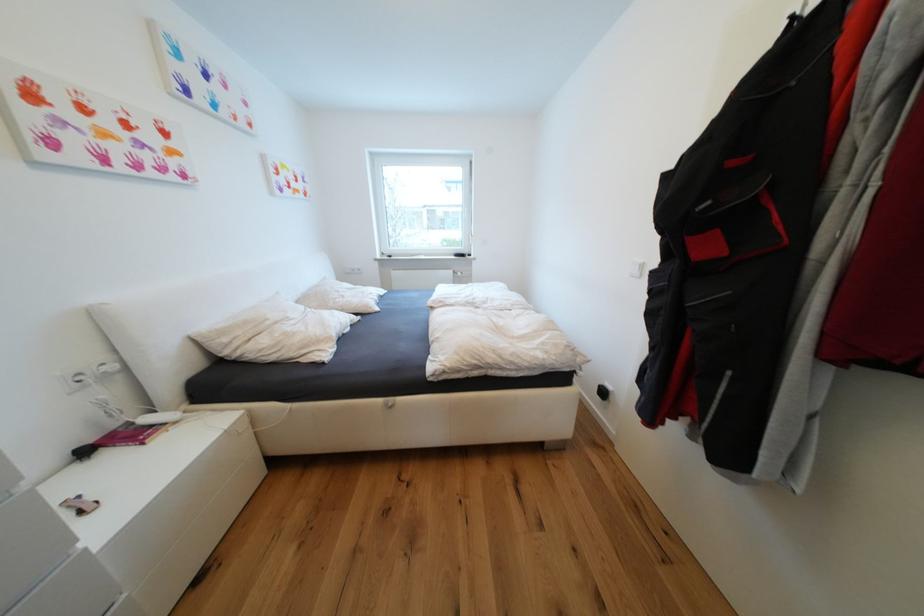
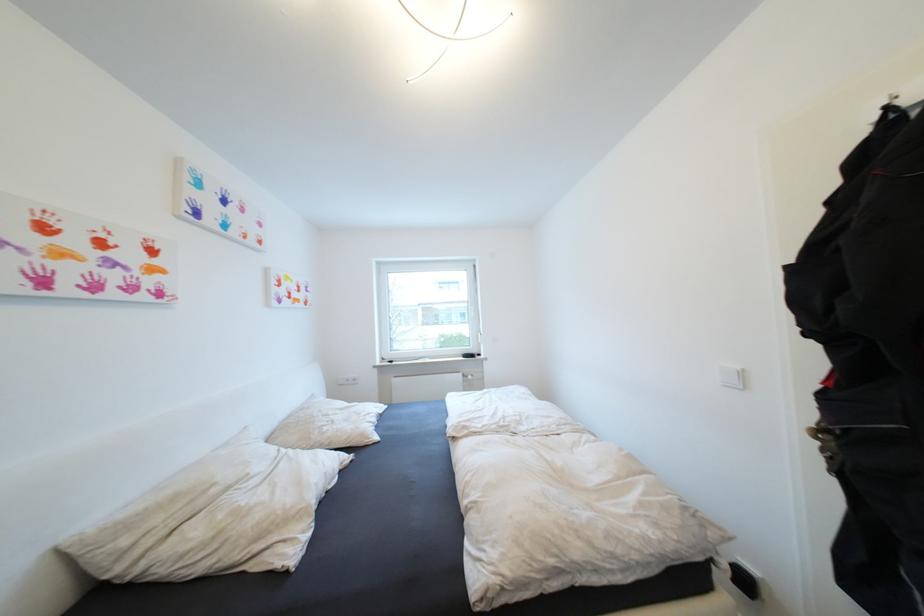
Based on the photo, what movement of the cameraman would produce the second image?

The cameraman walked toward left, forward.